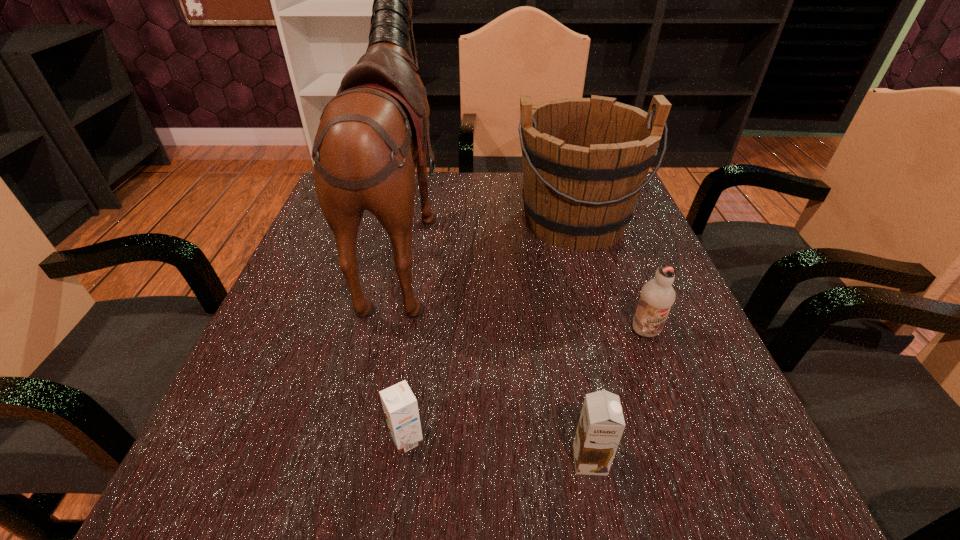
This screenshot has height=540, width=960. What are the coordinates of `blank space located on the front of the shortest chocolate milk` in the screenshot? It's located at (397, 502).

The width and height of the screenshot is (960, 540). I want to click on saddle present at the far edge, so click(371, 133).

Identify the location of wine bucket present at the far edge. This screenshot has width=960, height=540. (585, 160).

The width and height of the screenshot is (960, 540). Identify the location of object that is at the left edge. (371, 133).

Locate an element on the screen. wine bucket that is at the right edge is located at coordinates (585, 160).

This screenshot has width=960, height=540. I want to click on chocolate milk situated at the right edge, so tap(657, 296).

What are the coordinates of `object located at the far left corner` in the screenshot? It's located at (371, 133).

The width and height of the screenshot is (960, 540). In order to click on object that is at the far right corner in this screenshot , I will do `click(585, 160)`.

You are a GUI agent. You are given a task and a screenshot of the screen. Output one action in this format:
    pyautogui.click(x=<x>, y=<y>)
    Task: Click on the vacant region at the far edge of the desktop
    The width and height of the screenshot is (960, 540).
    Given the screenshot: What is the action you would take?
    pyautogui.click(x=510, y=195)

Find the location of `vacant space at the near edge`. vacant space at the near edge is located at coordinates (371, 455).